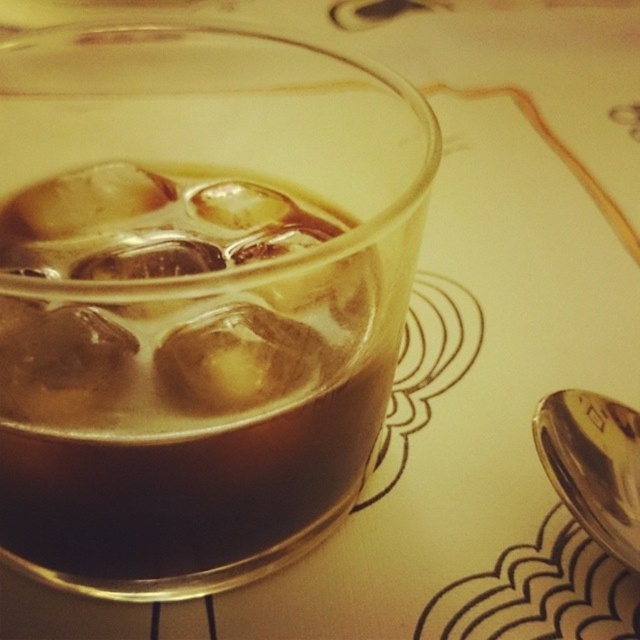
Image resolution: width=640 pixels, height=640 pixels. What do you see at coordinates (180, 372) in the screenshot? I see `translucent glass beverage at center` at bounding box center [180, 372].

Between translucent glass beverage at center and silver/metallic spoon at lower right, which one has less height?

Standing shorter between the two is silver/metallic spoon at lower right.

Who is more distant from viewer, (188, 330) or (621, 497)?

The point (621, 497) is more distant.

Where is `translucent glass beverage at center`? The image size is (640, 640). translucent glass beverage at center is located at coordinates (180, 372).